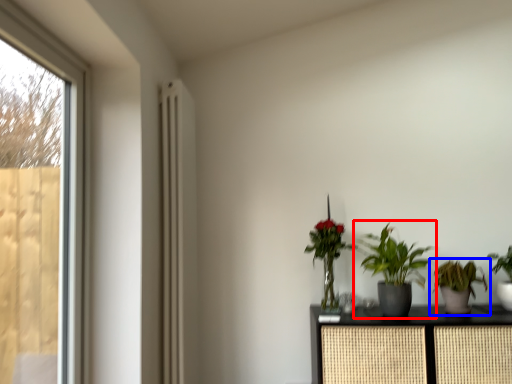
Question: Which object appears closest to the camera in this image, houseplant (highlighted by a red box) or houseplant (highlighted by a blue box)?

Choices:
 (A) houseplant
 (B) houseplant

Answer: (A)